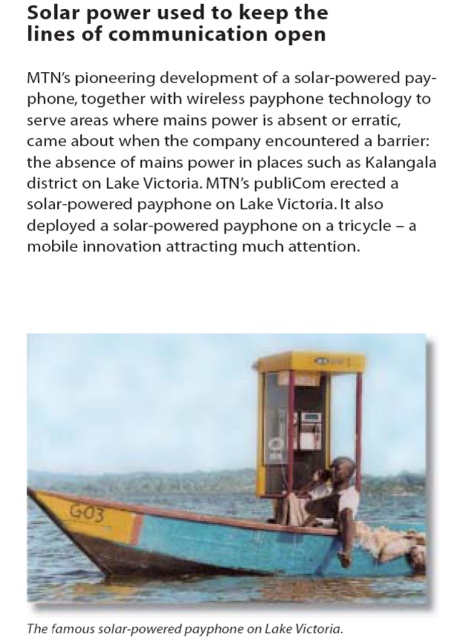
Locate an element on the screen. The image size is (457, 640). yellow painted wood canoe at lower center is located at coordinates (219, 541).

Is yellow painted wood canoe at lower center positioned in front of white matte shirt at center?

Yes, it is in front of white matte shirt at center.

Does point (191, 538) come closer to viewer compared to point (345, 461)?

That is True.

At what (x,y) coordinates should I click in order to perform the action: click on yellow painted wood canoe at lower center. Please return your answer as a coordinate pair (x, y). Looking at the image, I should click on (219, 541).

Who is taller, yellow painted wood canoe at lower center or yellow plastic phone box at center?

yellow painted wood canoe at lower center

Who is more forward, (x=97, y=548) or (x=302, y=428)?

Point (x=97, y=548)

Image resolution: width=457 pixels, height=640 pixels. What are the coordinates of `yellow painted wood canoe at lower center` in the screenshot? It's located at (219, 541).

In the scene shown: Who is shorter, yellow painted wood boat at center or yellow painted wood canoe at lower center?

yellow painted wood canoe at lower center

Consider the image. Can you confirm if yellow painted wood boat at center is positioned below yellow painted wood canoe at lower center?

Actually, yellow painted wood boat at center is above yellow painted wood canoe at lower center.

What do you see at coordinates (258, 496) in the screenshot?
I see `yellow painted wood boat at center` at bounding box center [258, 496].

Locate an element on the screen. yellow painted wood boat at center is located at coordinates (258, 496).